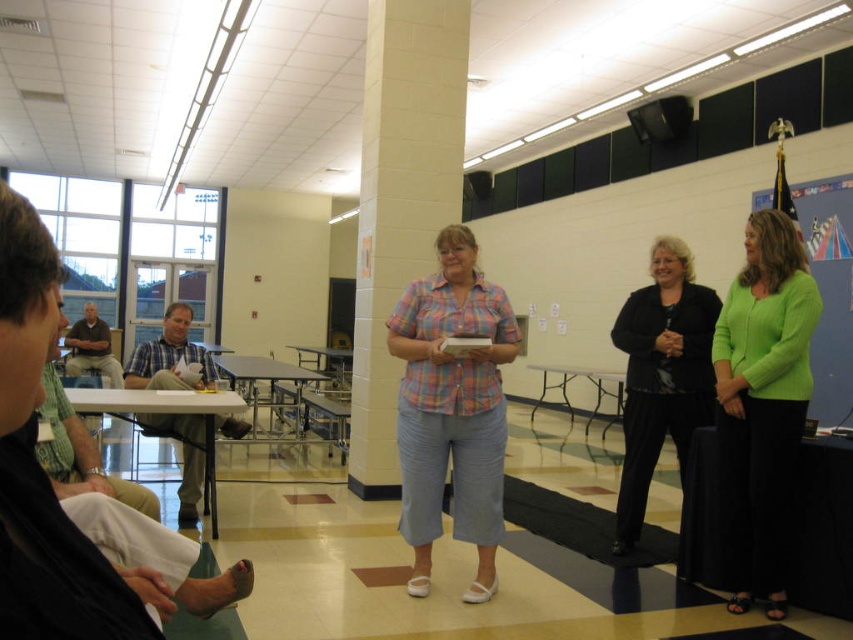
You are attending a presentation in this room and want to see both the black matte blazer at center and the plaid fabric shirt at center clearly. Which one appears larger in your view?

The black matte blazer at center appears larger because it is closer to the viewer than the plaid fabric shirt at center.